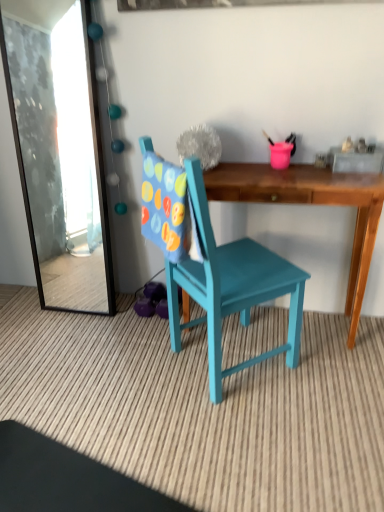
At what (x,y) coordinates should I click in order to perform the action: click on vacant area situated to the left side of teal painted wood chair at center. Please return your answer as a coordinate pair (x, y). The height and width of the screenshot is (512, 384). Looking at the image, I should click on (124, 369).